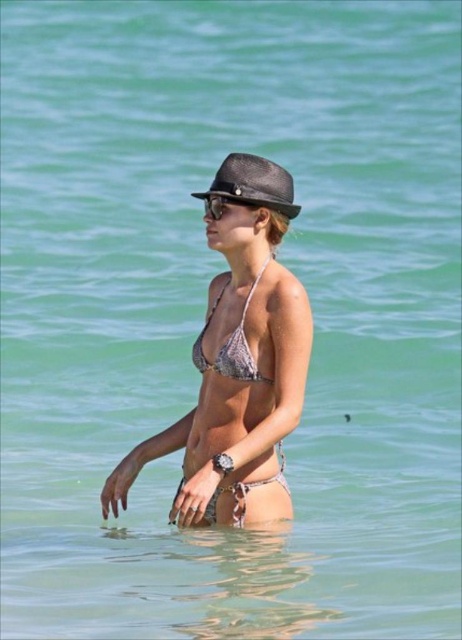
You are a photographer trying to capture the perfect shot of the printed fabric bikini at center. To ensure the subject is centered in the frame, you need to adjust your camera to focus precisely on the coordinates provided. What are the exact coordinates where you should aim your camera?

The printed fabric bikini at center is located at coordinates point (230,374), so you should aim your camera at those exact coordinates to ensure the subject is centered in the frame.

You are a fashion designer observing two bikinis in the image. The metallic silver bikini at center and the printed fabric bikini at center. Which one is located to the left?

The metallic silver bikini at center is positioned on the left side of the printed fabric bikini at center.

You are a fashion designer observing the beach scene. You need to determine which part of the printed fabric bikini at center and the printed fabric bikini top at center takes up more horizontal space in the image. Which one is wider?

The printed fabric bikini at center is wider than the printed fabric bikini top at center according to the description.